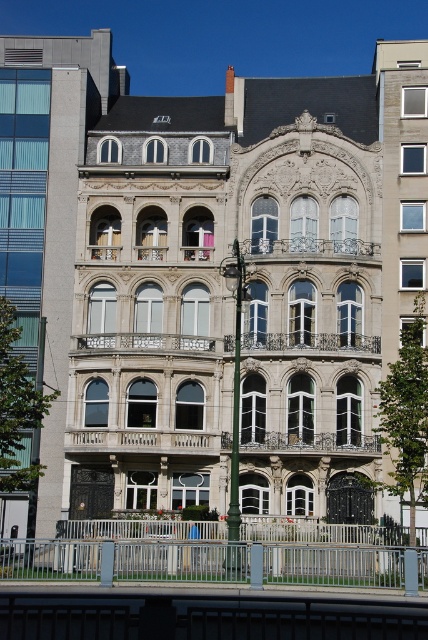
Between silver metallic railing at lower center and green metallic pole at center, which one appears on the left side from the viewer's perspective?

silver metallic railing at lower center is more to the left.

Does silver metallic railing at lower center have a smaller size compared to green metallic pole at center?

Yes, silver metallic railing at lower center is smaller than green metallic pole at center.

Does point (383, 566) come behind point (238, 394)?

No, (383, 566) is closer to viewer.

Identify the location of silver metallic railing at lower center. The image size is (428, 640). (341, 564).